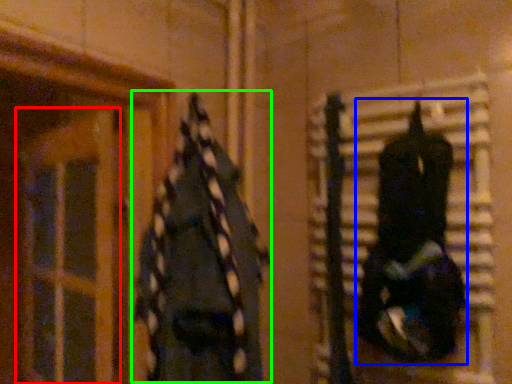
Question: Considering the real-world distances, which object is farthest from glass door (highlighted by a red box)? clothing (highlighted by a blue box) or clothing (highlighted by a green box)?

Choices:
 (A) clothing
 (B) clothing

Answer: (A)